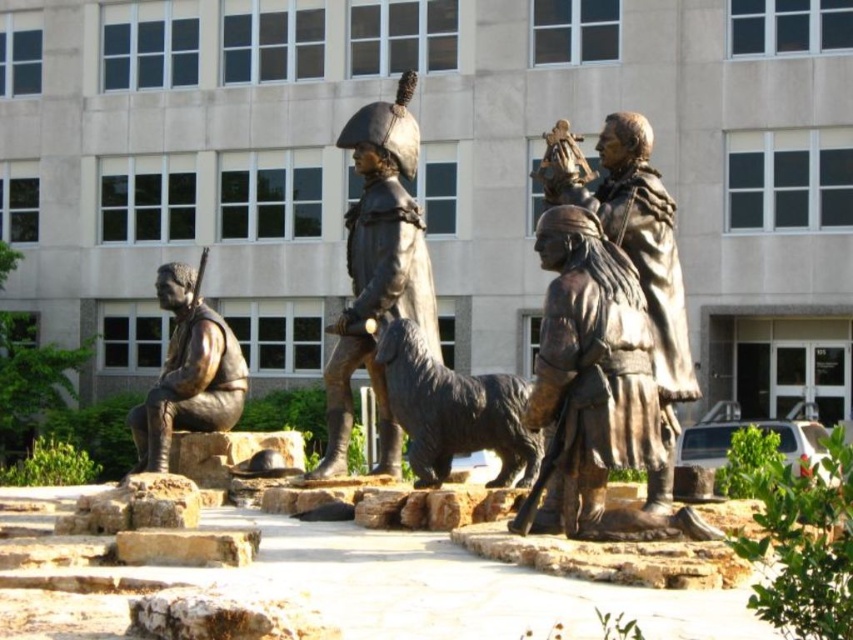
Which is below, bronze statue at center or shiny bronze dog at center?

shiny bronze dog at center is below.

This screenshot has width=853, height=640. I want to click on bronze statue at center, so click(x=378, y=269).

In the scene shown: Who is taller, bronze statue at center or bronze statue at left?

Standing taller between the two is bronze statue at center.

Between point (352, 227) and point (224, 387), which one is positioned behind?

The point (224, 387) is more distant.

At what (x,y) coordinates should I click in order to perform the action: click on bronze statue at center. Please return your answer as a coordinate pair (x, y). Looking at the image, I should click on (378, 269).

Is shiny bronze dog at center wider than bronze statue at left?

Yes.

Between shiny bronze dog at center and bronze statue at left, which one appears on the left side from the viewer's perspective?

bronze statue at left

Is point (397, 388) positioned behind point (183, 307)?

No, (397, 388) is closer to viewer.

Identify the location of shiny bronze dog at center. The height and width of the screenshot is (640, 853). (453, 410).